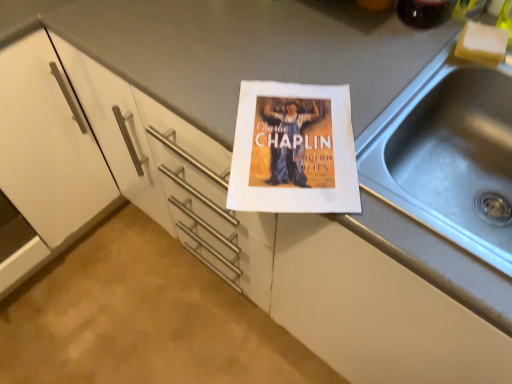
You are a GUI agent. You are given a task and a screenshot of the screen. Output one action in this format:
    pyautogui.click(x=<x>, y=<y>)
    Task: Click on the free space in front of translucent glass beverage at upper right
    The height and width of the screenshot is (384, 512).
    Given the screenshot: What is the action you would take?
    pyautogui.click(x=406, y=59)